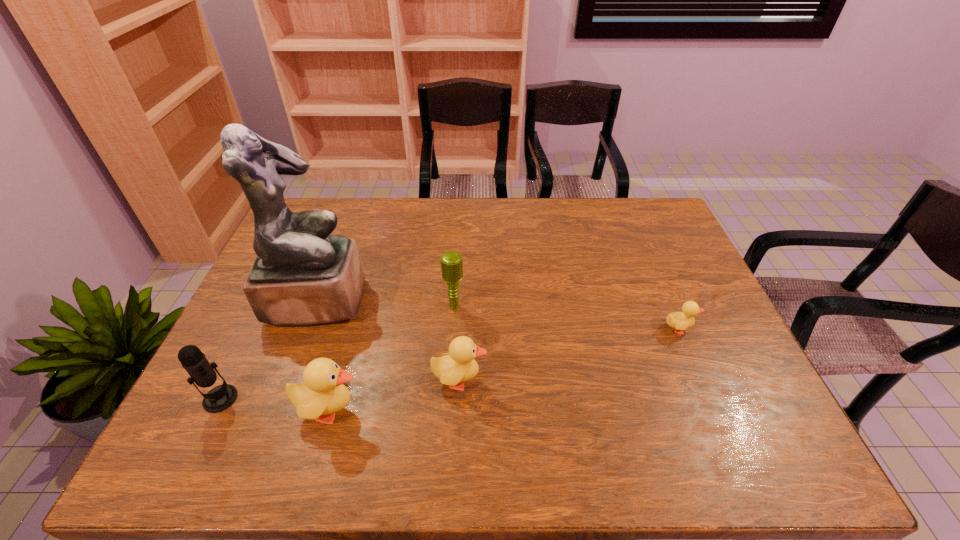
Identify which object is the fourth closest to the tallest object. Please provide its 2D coordinates. Your answer should be formatted as a tuple, i.e. [(x, y)], where the tuple contains the x and y coordinates of a point satisfying the conditions above.

[(459, 366)]

Locate which object is the fourth closest to the nearer microphone. Please provide its 2D coordinates. Your answer should be formatted as a tuple, i.e. [(x, y)], where the tuple contains the x and y coordinates of a point satisfying the conditions above.

[(451, 261)]

Point out which duckling is positioned as the third nearest to the nearer microphone. Please provide its 2D coordinates. Your answer should be formatted as a tuple, i.e. [(x, y)], where the tuple contains the x and y coordinates of a point satisfying the conditions above.

[(680, 321)]

Identify the location of duckling that is the third closest one to the tallest object. (680, 321).